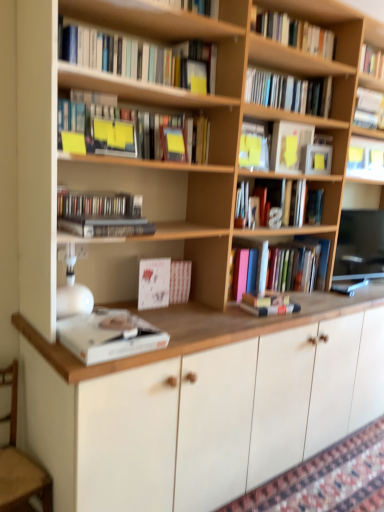
The height and width of the screenshot is (512, 384). Find the location of `vacant area that is in front of hardcover book at center, which is the eleventh book from top to bottom`. vacant area that is in front of hardcover book at center, which is the eleventh book from top to bottom is located at coordinates (267, 317).